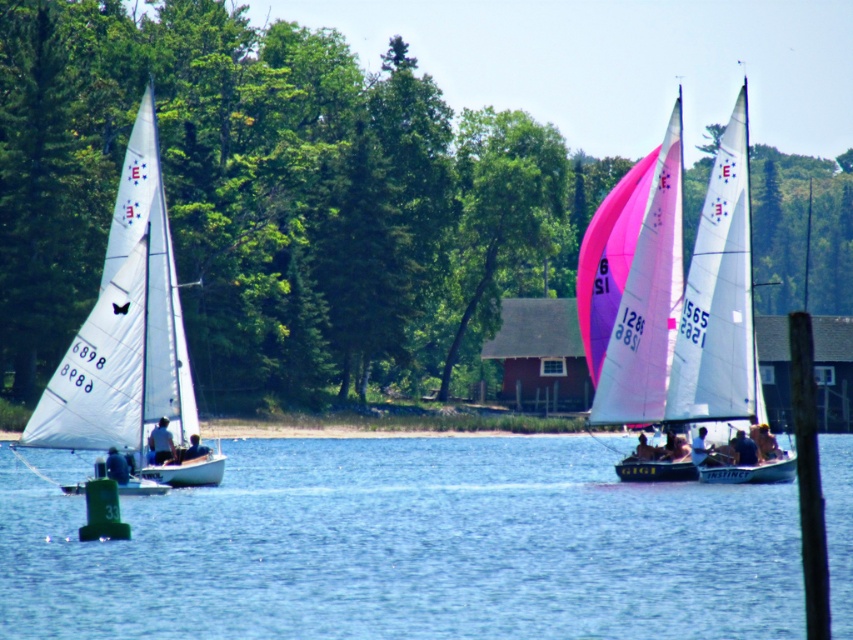
You are a photographer standing on the dock and want to take a photo of the blue fabric shirt at left and the dark blue fabric shirt at center. Which shirt will appear larger in the photo?

The blue fabric shirt at left is much taller than the dark blue fabric shirt at center, so it will appear larger in the photo.

You are a photographer standing at the edge of the water. You want to take a photo of the smooth skin face at center and the dark blue fabric at lower right. Which object should you focus on first to ensure both are in focus?

The dark blue fabric at lower right is closer to the viewer than the smooth skin face at center, so you should focus on the dark blue fabric at lower right first to ensure both are in focus.